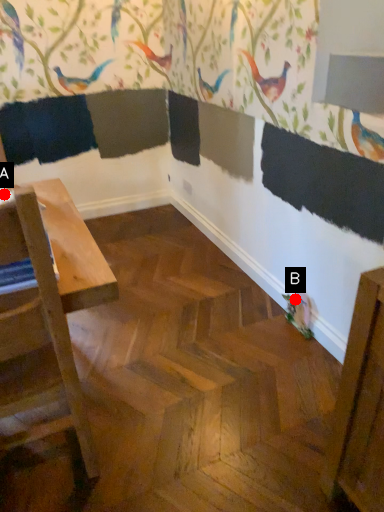
Question: Two points are circled on the image, labeled by A and B beside each circle. Which point is closer to the camera?

Choices:
 (A) A is closer
 (B) B is closer

Answer: (A)